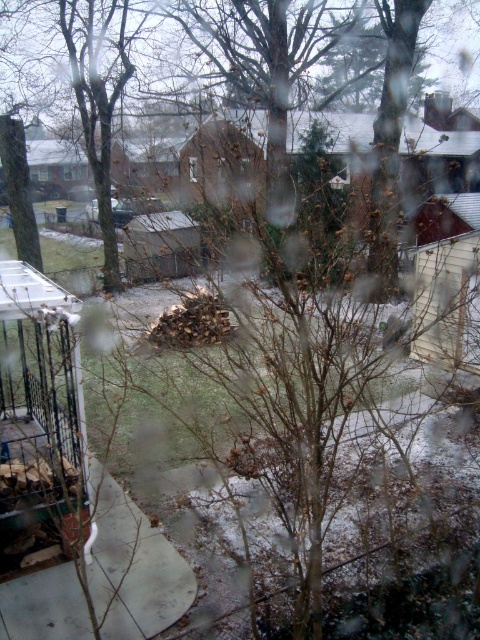
Is brown leafless tree at center positioned in front of transparent glass window at center?

Yes, brown leafless tree at center is closer to the viewer.

Does brown leafless tree at center have a greater width compared to transparent glass window at center?

Indeed, brown leafless tree at center has a greater width compared to transparent glass window at center.

Is point (206, 74) positioned before point (192, 164)?

That is True.

Where is `brown leafless tree at center`? The width and height of the screenshot is (480, 640). brown leafless tree at center is located at coordinates pyautogui.click(x=384, y=131).